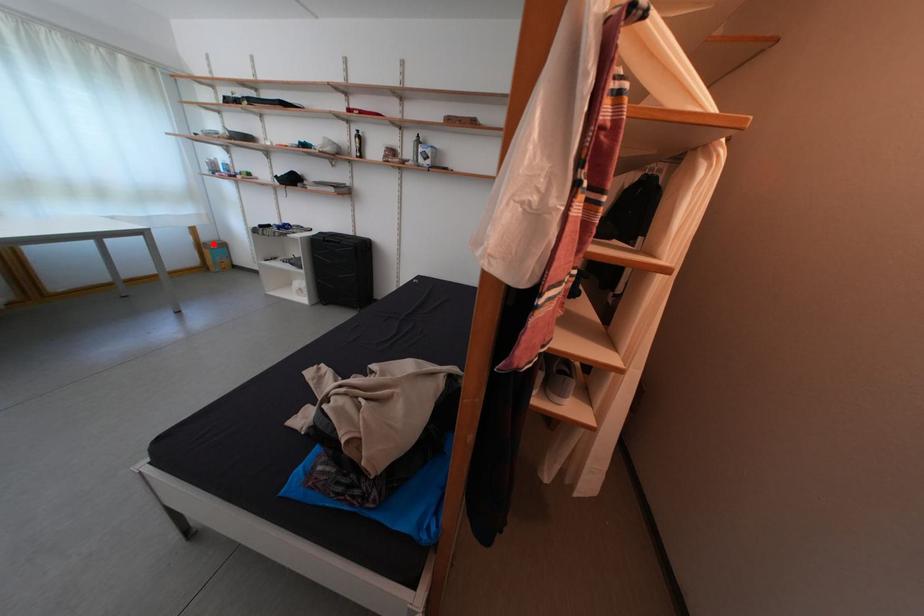
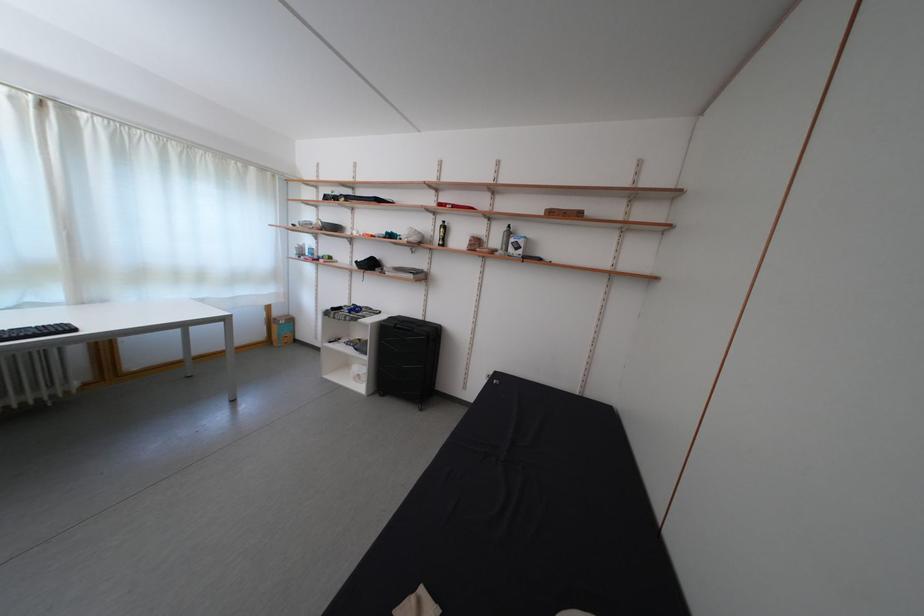
The point at the highlighted location is marked in the first image. Where is the corresponding point in the second image?

(285, 320)